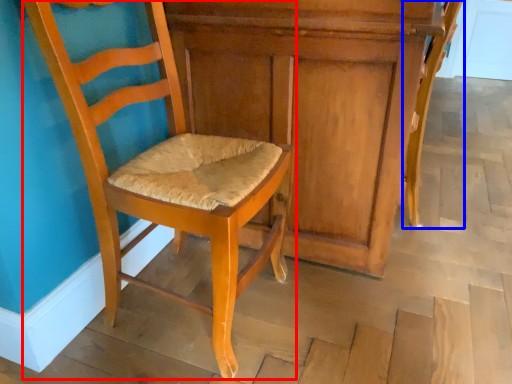
Question: Which object appears farthest to the camera in this image, chair (highlighted by a red box) or chair (highlighted by a blue box)?

Choices:
 (A) chair
 (B) chair

Answer: (B)